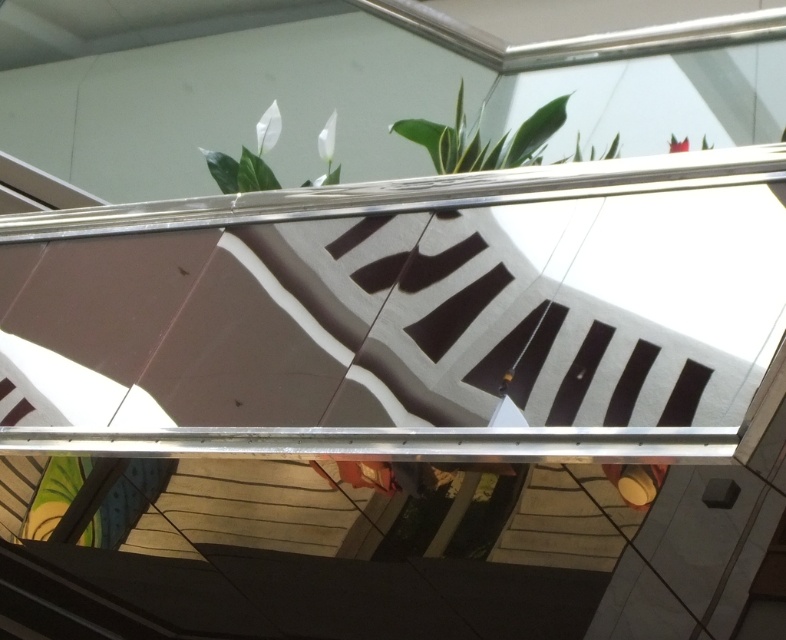
You are standing in the room where the image was taken. You want to place a new decorative item exactly at the same position as the green leafy plant at upper center. What coordinates should you aim for?

The green leafy plant at upper center is located at coordinates point (x=485, y=141), so you should aim for those coordinates to place the new decorative item.

You are an interior designer assessing the layout of the space. You notice the green leafy plant at upper center and the white matte leaf at upper center. Which object has a greater width in the image?

The green leafy plant at upper center is wider than the white matte leaf at upper center according to the description.

In the image, there is a reflective surface like a glass panel or mirror. There are two white flowers at the top, possibly peace lilies, and a larger leafy plant to their right. Where is the point located at coordinates [485,141] in relation to these plants?

The point at coordinates [485,141] marks the green leafy plant at upper center, which is located to the right of the two white flowers at the top.